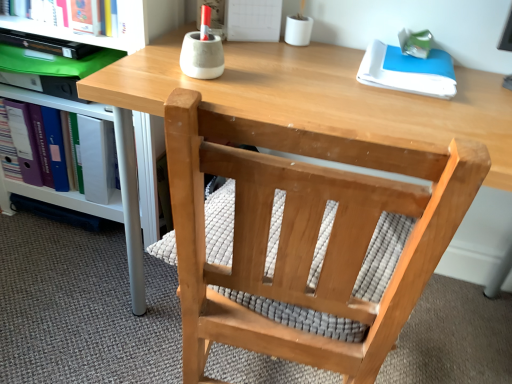
The height and width of the screenshot is (384, 512). I want to click on vacant space situated on the left part of white paper at upper right, so click(x=307, y=69).